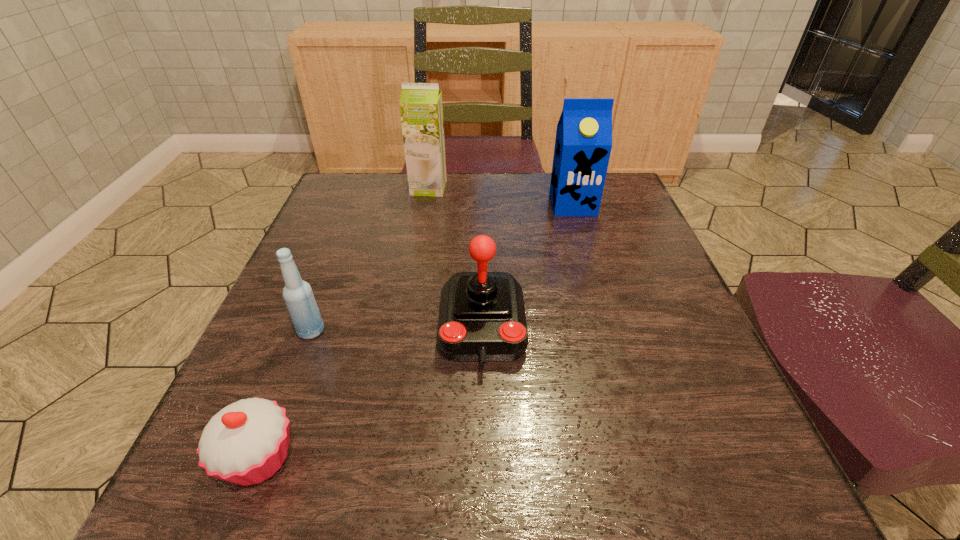
Locate an element on the screen. This screenshot has height=540, width=960. free space between the second object from right to left and the bottle is located at coordinates (396, 329).

Image resolution: width=960 pixels, height=540 pixels. Find the location of `empty location between the third object from left to right and the second object from right to left`. empty location between the third object from left to right and the second object from right to left is located at coordinates (455, 257).

The image size is (960, 540). I want to click on vacant area that lies between the cupcake and the bottle, so click(x=285, y=395).

What are the coordinates of `unoccupied position between the soya milk and the rightmost object` in the screenshot? It's located at (501, 196).

This screenshot has width=960, height=540. Identify the location of object that is the second closest to the joystick. (298, 296).

Choose which object is the nearest neighbor to the bottle. Please provide its 2D coordinates. Your answer should be formatted as a tuple, i.e. [(x, y)], where the tuple contains the x and y coordinates of a point satisfying the conditions above.

[(246, 442)]